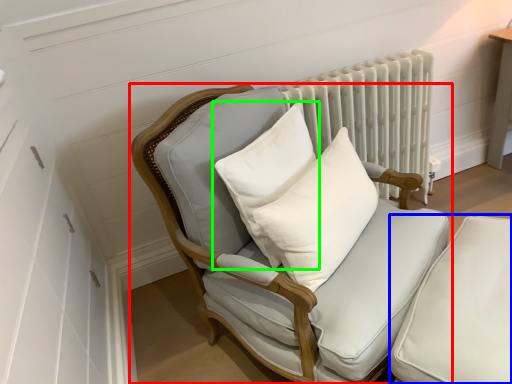
Question: Which object is the farthest from chair (highlighted by a red box)? Choose among these: swivel chair (highlighted by a blue box) or pillow (highlighted by a green box).

Choices:
 (A) swivel chair
 (B) pillow

Answer: (A)